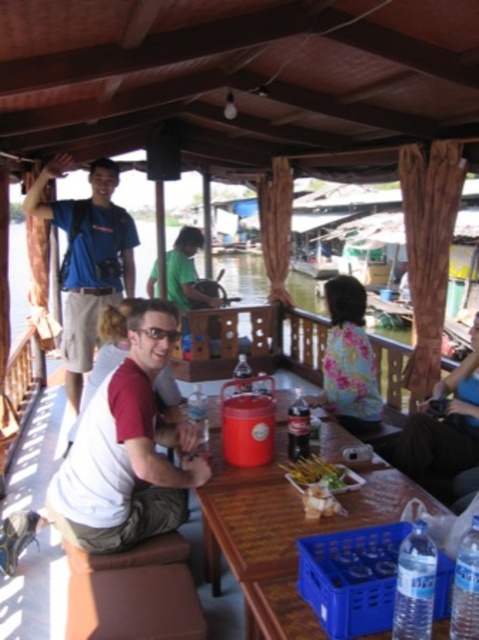
Does white matte shirt at center have a lesser height compared to golden crispy skewers at center?

Incorrect, white matte shirt at center's height does not fall short of golden crispy skewers at center's.

Which is more to the right, white matte shirt at center or golden crispy skewers at center?

From the viewer's perspective, golden crispy skewers at center appears more on the right side.

What do you see at coordinates (126, 451) in the screenshot?
I see `white matte shirt at center` at bounding box center [126, 451].

Where is `white matte shirt at center`? The height and width of the screenshot is (640, 479). white matte shirt at center is located at coordinates (126, 451).

Between wooden table at center and blue fabric shirt at upper left, which one appears on the right side from the viewer's perspective?

wooden table at center is more to the right.

Is the position of wooden table at center less distant than that of blue fabric shirt at upper left?

Yes, wooden table at center is in front of blue fabric shirt at upper left.

Is point (203, 609) less distant than point (81, 246)?

That is True.

This screenshot has width=479, height=640. I want to click on wooden table at center, so pyautogui.click(x=273, y=540).

Is wooden table at center below white matte shirt at center?

Yes.

Between point (293, 518) and point (168, 426), which one is positioned behind?

Positioned behind is point (168, 426).

Locate an element on the screen. This screenshot has height=640, width=479. wooden table at center is located at coordinates (273, 540).

At what (x,y) coordinates should I click in order to perform the action: click on wooden table at center. Please return your answer as a coordinate pair (x, y). Looking at the image, I should click on (273, 540).